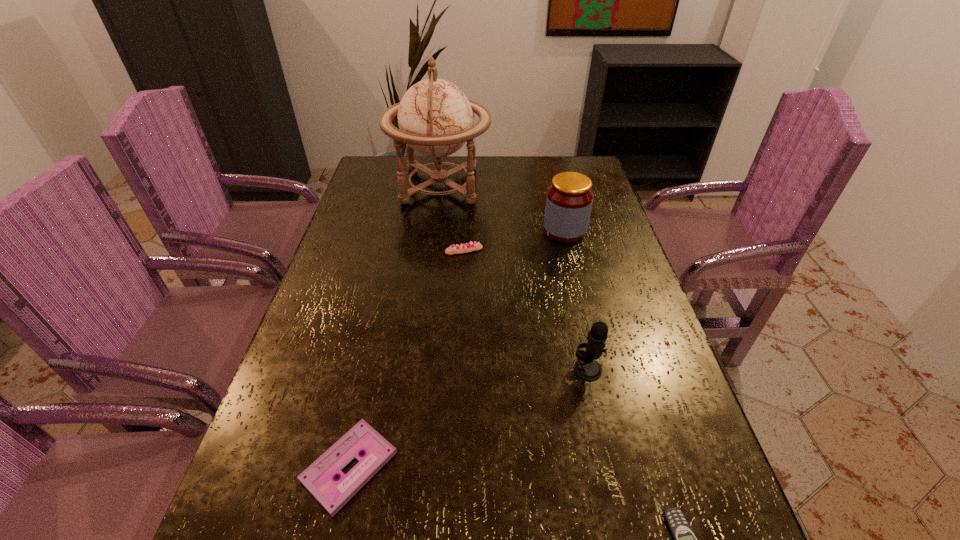
Where is `vacant region that satisfies the following two spatial constraints: 1. on the back side of the videotape; 2. on the right side of the fifth nearest object`? The width and height of the screenshot is (960, 540). vacant region that satisfies the following two spatial constraints: 1. on the back side of the videotape; 2. on the right side of the fifth nearest object is located at coordinates (402, 230).

Locate an element on the screen. Image resolution: width=960 pixels, height=540 pixels. vacant area that satisfies the following two spatial constraints: 1. on the front-facing side of the farthest object; 2. on the left side of the microphone is located at coordinates (416, 369).

Find the location of a particular element. This screenshot has height=540, width=960. free space that satisfies the following two spatial constraints: 1. on the back side of the third nearest object; 2. on the front-facing side of the farthest object is located at coordinates (547, 185).